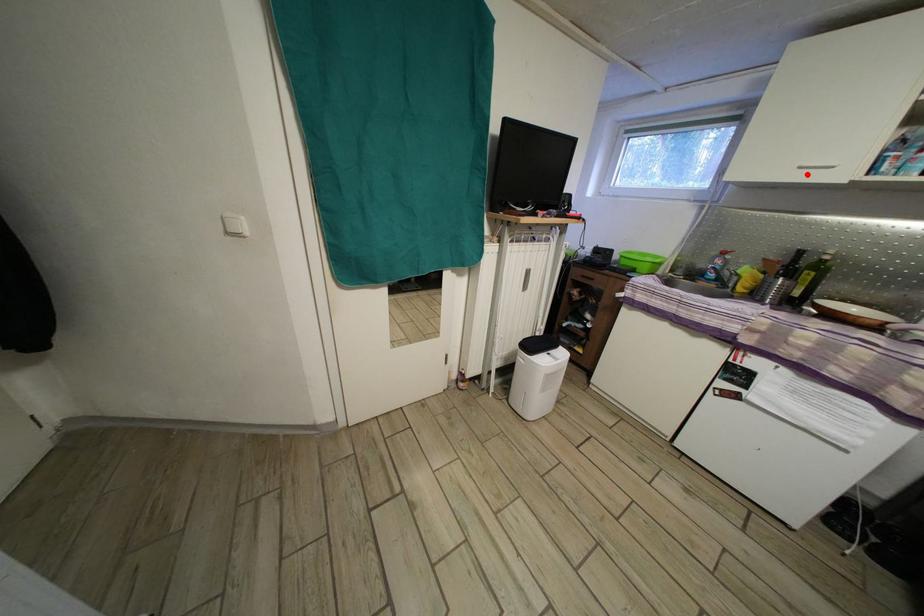
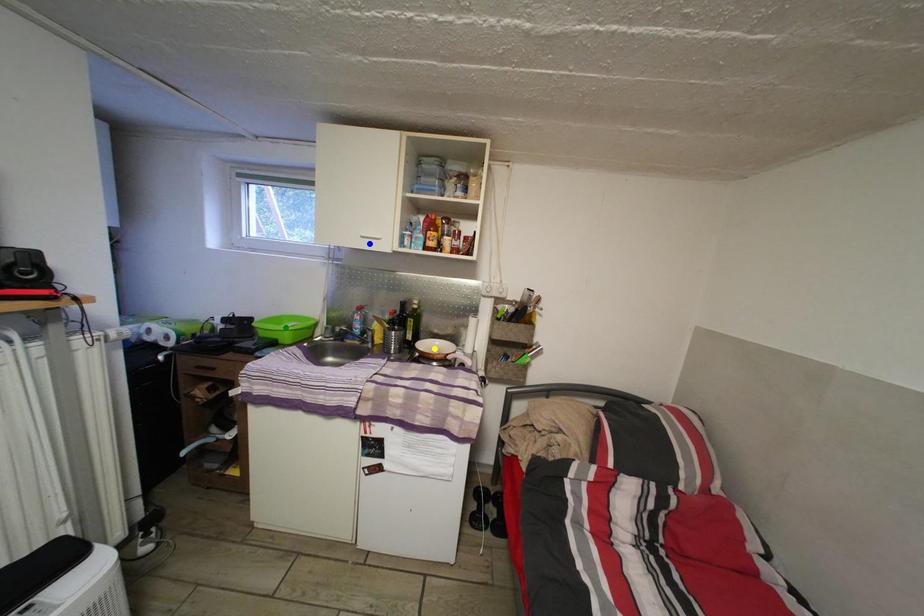
Question: I am providing you with two images of the same scene from different viewpoints. A red point is marked on the first image. You are given multiple points on the second image. Which spot in image 2 lines up with the point in image 1?

Choices:
 (A) green point
 (B) blue point
 (C) yellow point

Answer: (B)